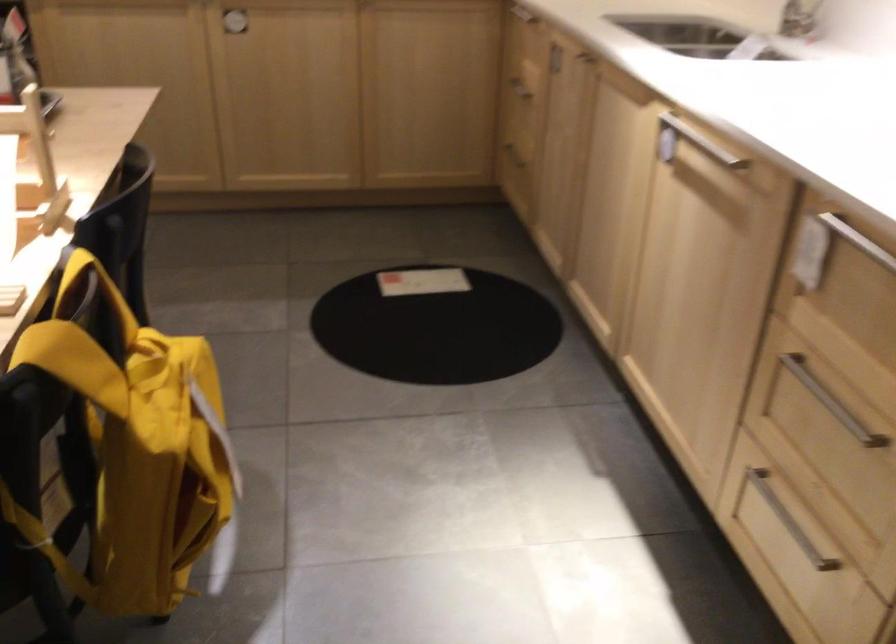
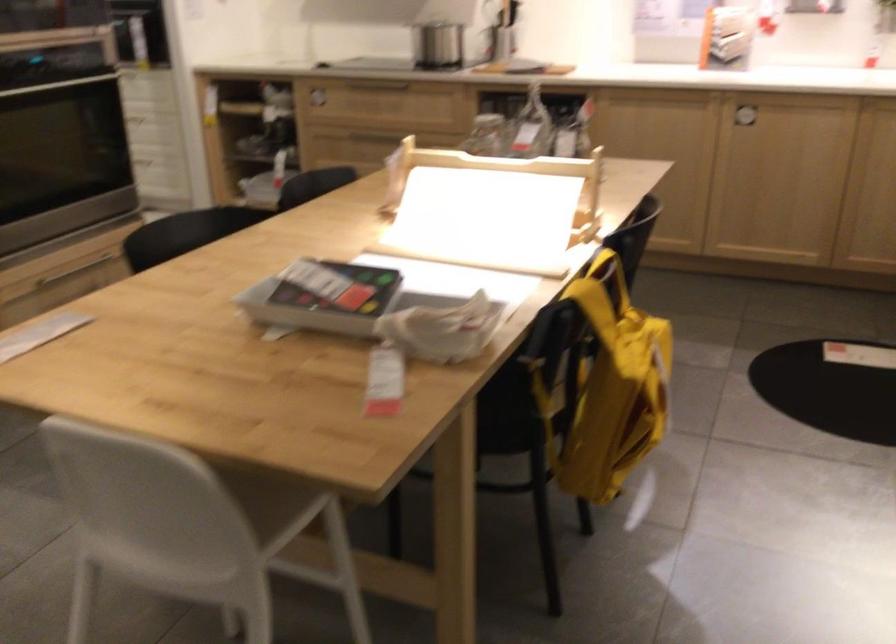
Where in the second image is the point corresponding to the point at 149,468 from the first image?

(609, 386)